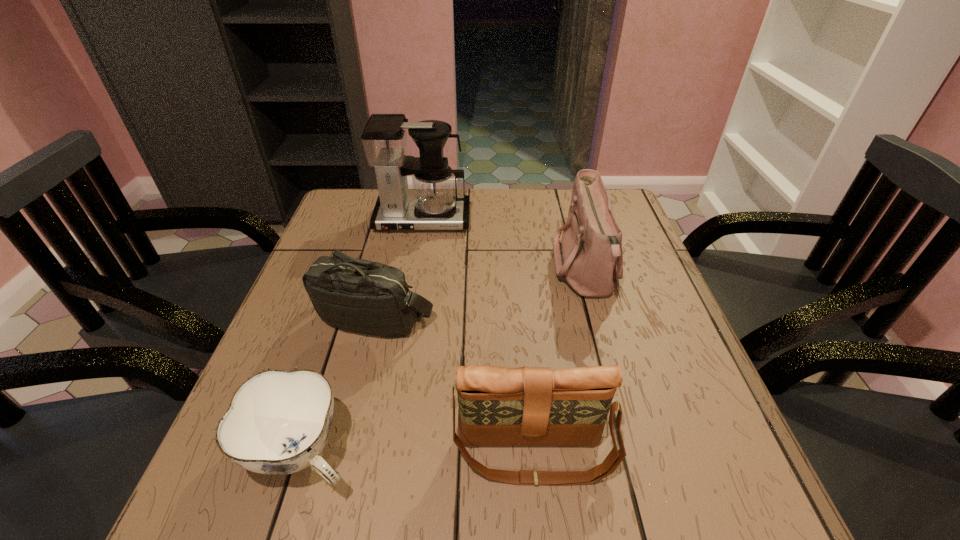
Locate an element on the screen. This screenshot has width=960, height=540. coffee maker is located at coordinates (434, 205).

Identify the location of the leftmost shoulder bag. (357, 295).

In order to click on the nearest shoulder bag in this screenshot , I will do [x=497, y=406].

Image resolution: width=960 pixels, height=540 pixels. Identify the location of the shortest object. (278, 422).

You are a GUI agent. You are given a task and a screenshot of the screen. Output one action in this format:
    pyautogui.click(x=<x>, y=<y>)
    Task: Click on the free space located 0.210m at the front of the coffee maker where the controls are located
    This screenshot has height=540, width=960.
    Given the screenshot: What is the action you would take?
    pyautogui.click(x=411, y=286)

The width and height of the screenshot is (960, 540). I want to click on blank area located 0.290m at the front padded panel of the leftmost shoulder bag, so pos(334,481).

Locate an element on the screen. The image size is (960, 540). vacant position located on the front-facing side of the nearest shoulder bag is located at coordinates (541, 527).

I want to click on vacant space located on the right of the chinaware, so click(486, 453).

At what (x,y) coordinates should I click in order to perform the action: click on object located at the far edge. Please return your answer as a coordinate pair (x, y). The width and height of the screenshot is (960, 540). Looking at the image, I should click on (434, 205).

Locate an element on the screen. shoulder bag that is at the near edge is located at coordinates (497, 406).